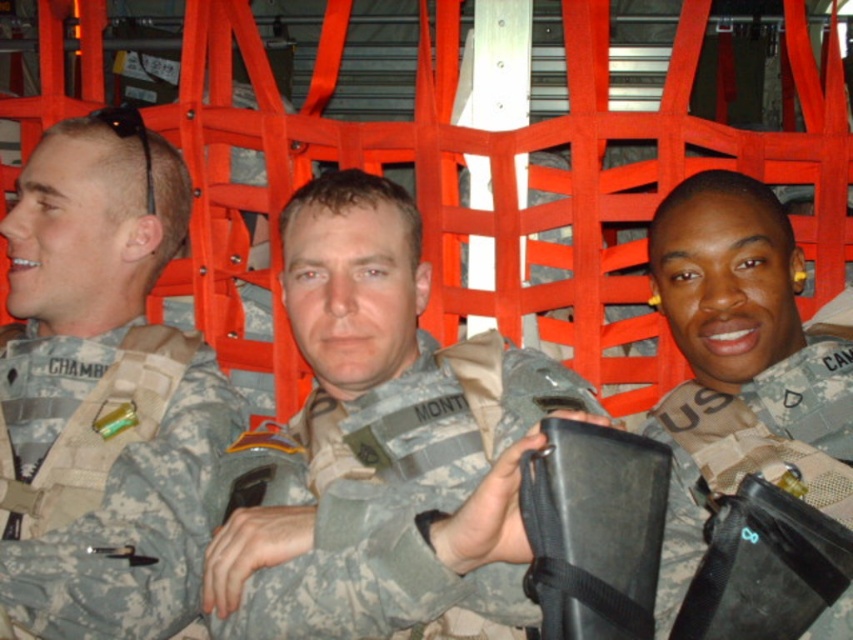
Question: Among these points, which one is nearest to the camera?

Choices:
 (A) (367, 358)
 (B) (57, 401)

Answer: (A)

Question: Considering the relative positions of camouflage fabric uniform at center and camouflage fabric uniform at left in the image provided, where is camouflage fabric uniform at center located with respect to camouflage fabric uniform at left?

Choices:
 (A) above
 (B) below

Answer: (A)

Question: Which point is closer to the camera?

Choices:
 (A) camouflage fabric utility belt at center
 (B) camouflage fabric uniform at left
 (C) camouflage fabric uniform at center

Answer: (C)

Question: Can you confirm if camouflage fabric uniform at left is positioned above camouflage fabric utility belt at center?

Choices:
 (A) no
 (B) yes

Answer: (A)

Question: Is camouflage fabric uniform at center wider than camouflage fabric uniform at left?

Choices:
 (A) yes
 (B) no

Answer: (A)

Question: Which point is closer to the camera taking this photo?

Choices:
 (A) (320, 340)
 (B) (830, 362)

Answer: (A)